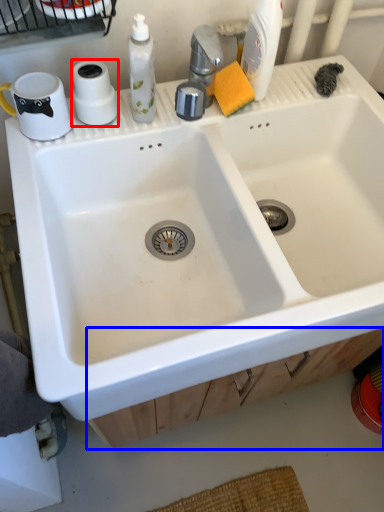
Question: Which object appears closest to the camera in this image, toilet paper (highlighted by a red box) or drawer (highlighted by a blue box)?

Choices:
 (A) toilet paper
 (B) drawer

Answer: (A)